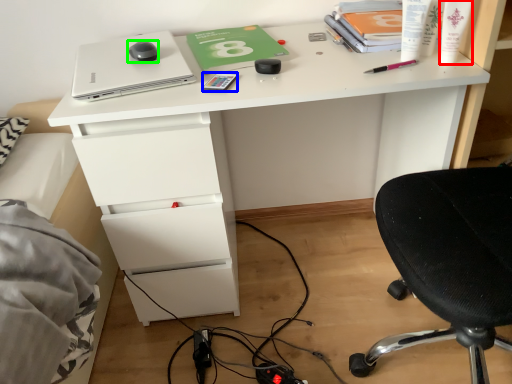
Question: Which object is the closest to the toiletry (highlighted by a red box)? Choose among these: stationery (highlighted by a blue box) or mouse (highlighted by a green box).

Choices:
 (A) stationery
 (B) mouse

Answer: (A)